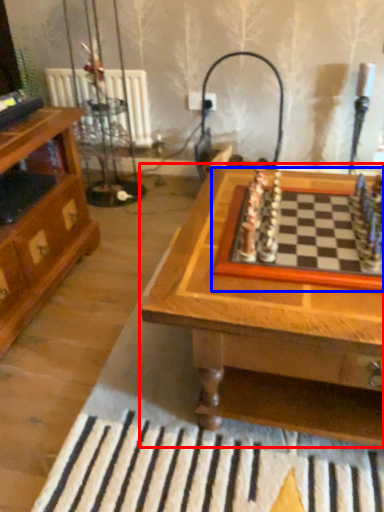
Question: Which object appears farthest to the camera in this image, table (highlighted by a red box) or board game (highlighted by a blue box)?

Choices:
 (A) table
 (B) board game

Answer: (B)